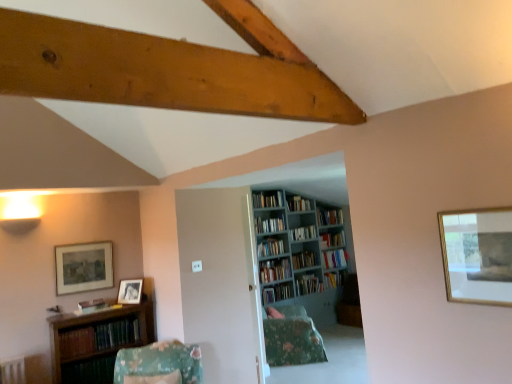
Question: From the image's perspective, is matte wooden picture frame at left, marked as the second picture frame in a bottom-to-top arrangement, below hardcover books at center, which is counted as the 5th book, starting from the back?

Choices:
 (A) yes
 (B) no

Answer: (B)

Question: Are matte wooden picture frame at left, which appears as the second picture frame when viewed from the back, and hardcover books at center, which is counted as the 5th book, starting from the back, far apart?

Choices:
 (A) no
 (B) yes

Answer: (B)

Question: Does matte wooden picture frame at left, the second picture frame from the front, have a greater width compared to hardcover books at center, which is counted as the 5th book, starting from the back?

Choices:
 (A) no
 (B) yes

Answer: (A)

Question: From a real-world perspective, is matte wooden picture frame at left, the 3th picture frame viewed from the right, below hardcover books at center, arranged as the 5th book when viewed from the front?

Choices:
 (A) yes
 (B) no

Answer: (B)

Question: Does matte wooden picture frame at left, the second picture frame from the front, have a smaller size compared to hardcover books at center, arranged as the 5th book when viewed from the front?

Choices:
 (A) yes
 (B) no

Answer: (A)

Question: Is point (336, 273) positioned closer to the camera than point (334, 233)?

Choices:
 (A) closer
 (B) farther

Answer: (A)

Question: Considering their positions, is hardcover book at center, which is the 3th book in back-to-front order, located in front of or behind hardcover book at center, the eighth book viewed from the front?

Choices:
 (A) front
 (B) behind

Answer: (A)

Question: Looking at their shapes, would you say hardcover book at center, which is the 3th book in back-to-front order, is wider or thinner than hardcover book at center, the eighth book viewed from the front?

Choices:
 (A) thin
 (B) wide

Answer: (A)

Question: From a real-world perspective, is hardcover book at center, the 7th book when ordered from front to back, above or below hardcover book at center, the second book viewed from the back?

Choices:
 (A) above
 (B) below

Answer: (B)

Question: Considering their positions, is gold-framed picture at upper right, the first picture frame when ordered from front to back, located in front of or behind hardcover book at center, positioned as the ninth book in front-to-back order?

Choices:
 (A) behind
 (B) front

Answer: (B)

Question: From a real-world perspective, is gold-framed picture at upper right, the first picture frame positioned from the right, physically located above or below hardcover book at center, positioned as the first book in back-to-front order?

Choices:
 (A) below
 (B) above

Answer: (B)

Question: From the image's perspective, is gold-framed picture at upper right, the first picture frame when ordered from front to back, positioned above or below hardcover book at center, positioned as the ninth book in front-to-back order?

Choices:
 (A) below
 (B) above

Answer: (B)

Question: Do you think gold-framed picture at upper right, the first picture frame positioned from the right, is within hardcover book at center, positioned as the ninth book in front-to-back order, or outside of it?

Choices:
 (A) outside
 (B) inside

Answer: (A)

Question: From a real-world perspective, relative to matte wooden picture frame at left, the 1th picture frame when ordered from left to right, is hardcover book at center, positioned as the ninth book in front-to-back order, vertically above or below?

Choices:
 (A) above
 (B) below

Answer: (B)

Question: Is hardcover book at center, positioned as the ninth book in front-to-back order, spatially inside matte wooden picture frame at left, the second picture frame from the front, or outside of it?

Choices:
 (A) outside
 (B) inside

Answer: (A)